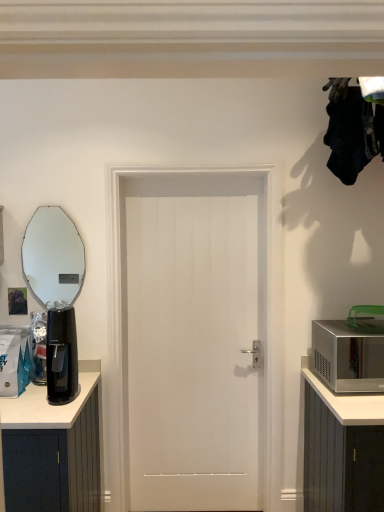
Question: Relative to silver metallic microwave at right, is black plastic coffee maker at left in front or behind?

Choices:
 (A) front
 (B) behind

Answer: (A)

Question: From their relative heights in the image, would you say black plastic coffee maker at left is taller or shorter than silver metallic microwave at right?

Choices:
 (A) tall
 (B) short

Answer: (A)

Question: Based on their relative distances, which object is farther from the silver metallic microwave at right?

Choices:
 (A) oval mirror at left
 (B) black plastic coffee maker at left
 (C) white smooth door at center

Answer: (A)

Question: Which object is the farthest from the black plastic coffee maker at left?

Choices:
 (A) white smooth door at center
 (B) oval mirror at left
 (C) silver metallic microwave at right

Answer: (B)